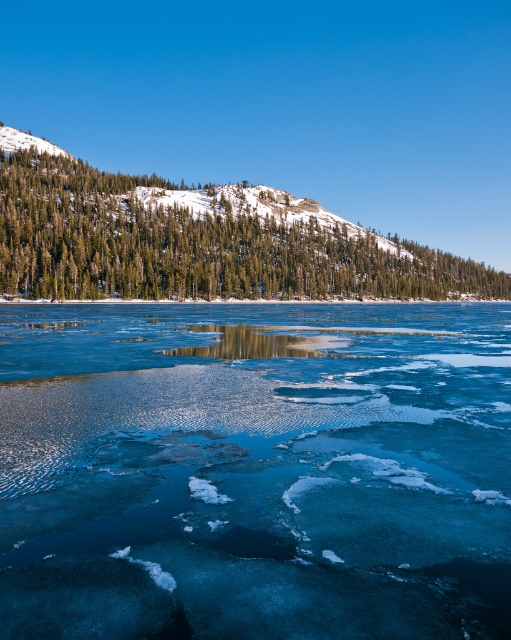
From the picture: You are a hiker planning to cross the frozen lake. You need to reach the green textured pine trees at upper left from the translucent ice at center. Given that your average walking speed is 3 miles per hour, approximately how many minutes will it take you to reach the trees?

The translucent ice at center is 500.31 feet away from green textured pine trees at upper left. Converting feet to miles, 500.31 feet is approximately 0.0947 miles. At a walking speed of 3 miles per hour, the time taken would be distance divided by speed, so 0.0947 miles divided by 3 mph equals approximately 0.0316 hours. Converting hours to minutes by multiplying by 60 gives roughly 1.9 minutes. Therefore, it would take about 2 minutes to reach the green textured pine trees at upper left.

You are an ice skater planning to glide across the frozen lake. You notice the translucent ice at center and the green textured pine trees at upper left. Which area would you avoid stepping on based on their spatial relationship?

You should avoid stepping on the translucent ice at center because it occupies less space than the green textured pine trees at upper left, indicating it might be thinner and unsafe for skating.